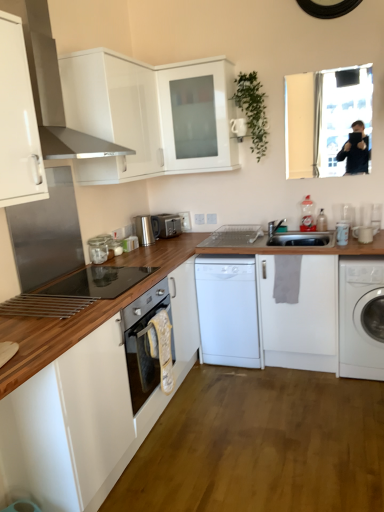
Question: Is white matte dishwasher at center, marked as the 2th washing machine in a right-to-left arrangement, taller or shorter than white glossy mug at right, which is counted as the 2th appliance, starting from the right?

Choices:
 (A) short
 (B) tall

Answer: (B)

Question: From a real-world perspective, is white matte dishwasher at center, acting as the 1th washing machine starting from the left, above or below white glossy mug at right, marked as the second appliance in a front-to-back arrangement?

Choices:
 (A) above
 (B) below

Answer: (B)

Question: Based on their relative distances, which object is nearer to the white glossy cabinet at upper left, the third cabinetry when ordered from top to bottom?

Choices:
 (A) satin silver toaster at center, which is counted as the 1th appliance, starting from the left
 (B) white glossy mug at right, which is the first appliance from right to left
 (C) white glossy mug at right, which is the third appliance from back to front
 (D) wooden countertop at left, which is the fourth cabinetry from top to bottom
 (E) white plastic dishwasher at center, the 3th appliance from the right

Answer: (D)

Question: Based on their relative distances, which object is nearer to the satin silver toaster at center, the 1th appliance in the back-to-front sequence?

Choices:
 (A) white glossy mug at right, the 4th appliance positioned from the back
 (B) white plastic dishwasher at center, the 3th appliance from the right
 (C) white glossy cabinet at upper left, the third cabinetry when ordered from top to bottom
 (D) silver metallic faucet at center
 (E) white matte dishwasher at center, marked as the 2th washing machine in a right-to-left arrangement

Answer: (B)